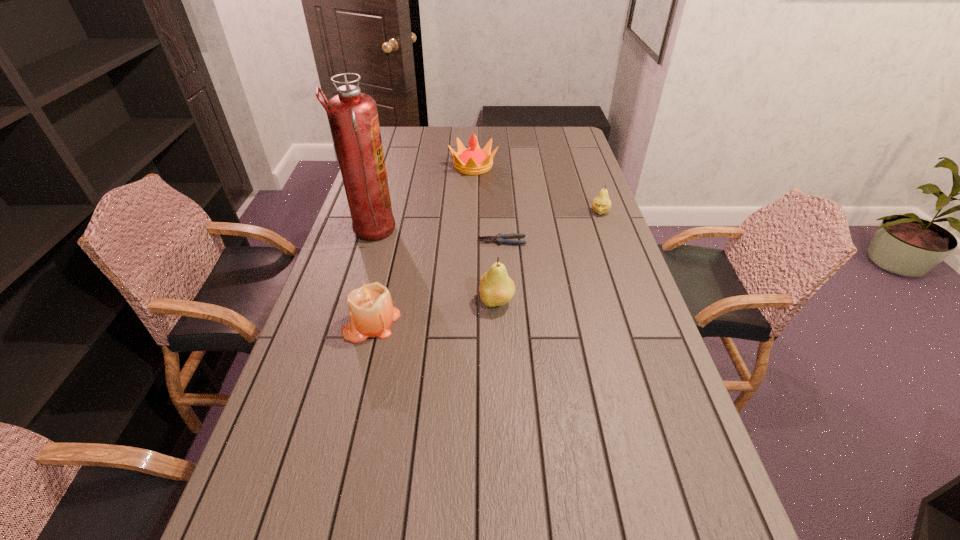
You are a GUI agent. You are given a task and a screenshot of the screen. Output one action in this format:
    pyautogui.click(x=<x>, y=<y>)
    Task: Click on the free point between the tallest object and the pliers
    
    Given the screenshot: What is the action you would take?
    pyautogui.click(x=437, y=237)

Where is `vacant region between the left pear and the tallest object`? The image size is (960, 540). vacant region between the left pear and the tallest object is located at coordinates (434, 267).

Identify the location of vacant area between the rightmost object and the pliers. The image size is (960, 540). (551, 227).

You are a GUI agent. You are given a task and a screenshot of the screen. Output one action in this format:
    pyautogui.click(x=<x>, y=<y>)
    Task: Click on the unoccupied area between the fire extinguisher and the second farthest object
    Image resolution: width=960 pixels, height=540 pixels.
    Given the screenshot: What is the action you would take?
    click(x=486, y=222)

This screenshot has width=960, height=540. In order to click on free area in between the left pear and the crown in this screenshot , I will do `click(485, 234)`.

Identify the location of object that is the third closest to the tallest object. [473, 161].

Select which object is the fifth closest to the rightmost object. Please provide its 2D coordinates. Your answer should be formatted as a tuple, i.e. [(x, y)], where the tuple contains the x and y coordinates of a point satisfying the conditions above.

[(371, 310)]

You are a GUI agent. You are given a task and a screenshot of the screen. Output one action in this format:
    pyautogui.click(x=<x>, y=<y>)
    Task: Click on the vacant region that satisfies the following two spatial constraints: 1. on the side of the candle with the label; 2. on the left side of the fire extinguisher
    The image size is (960, 540).
    Given the screenshot: What is the action you would take?
    pyautogui.click(x=344, y=323)

Image resolution: width=960 pixels, height=540 pixels. I want to click on free spot that satisfies the following two spatial constraints: 1. on the side of the fire extinguisher with the label; 2. on the right side of the nearer pear, so click(350, 302).

I want to click on vacant region that satisfies the following two spatial constraints: 1. on the side of the tallest object with the label; 2. on the back side of the nearer pear, so click(x=350, y=302).